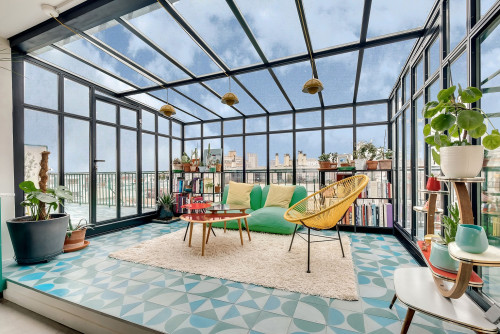
Locate an element on the screen. door is located at coordinates (105, 177).